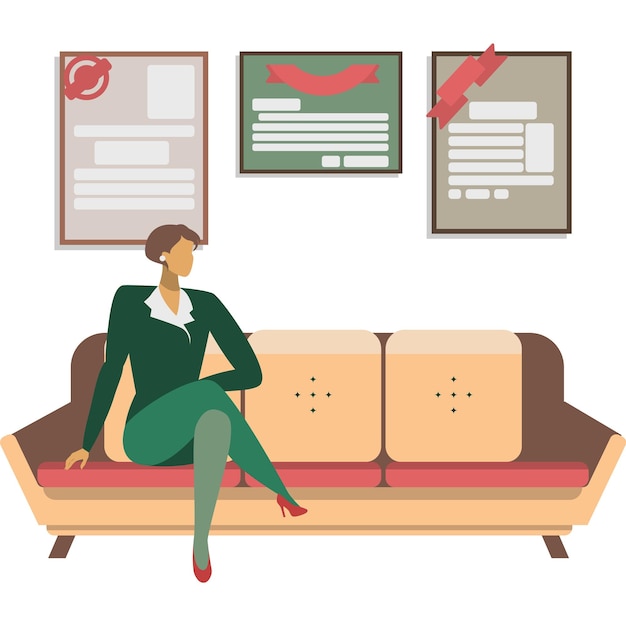
Where is `hanging picture frames`? This screenshot has width=626, height=626. hanging picture frames is located at coordinates (123, 100), (530, 76), (384, 95).